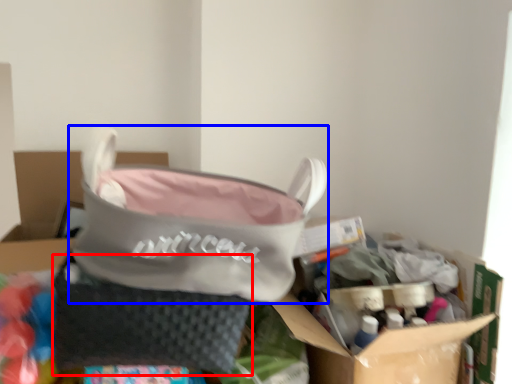
Question: Which of the following is the farthest to the observer, pouch (highlighted by a red box) or handbag (highlighted by a blue box)?

Choices:
 (A) pouch
 (B) handbag

Answer: (A)